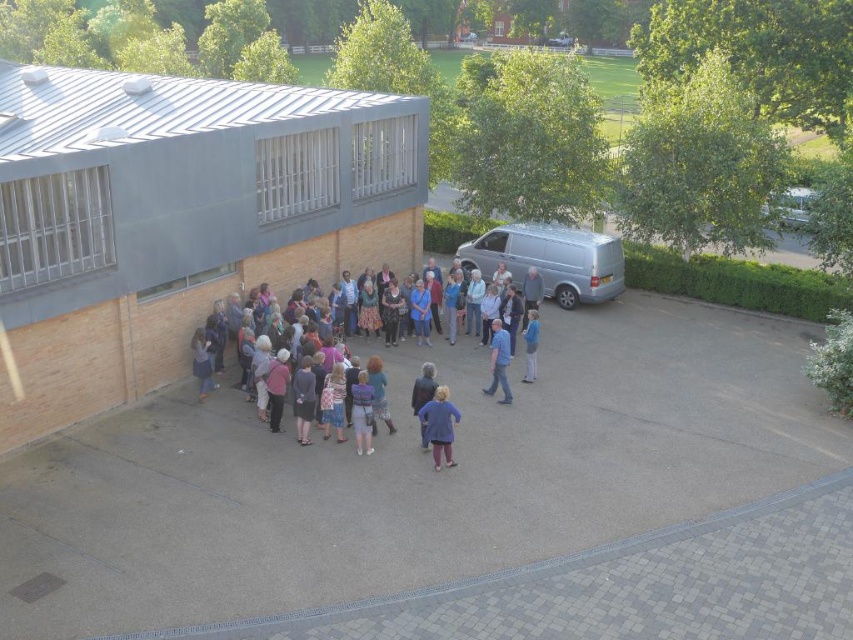
Is multicolored casual attire at center wider than white metallic van at upper right?

No, multicolored casual attire at center is not wider than white metallic van at upper right.

Who is taller, multicolored casual attire at center or white metallic van at upper right?

white metallic van at upper right is taller.

What do you see at coordinates (392, 378) in the screenshot?
I see `multicolored casual attire at center` at bounding box center [392, 378].

At what (x,y) coordinates should I click in order to perform the action: click on multicolored casual attire at center. Please return your answer as a coordinate pair (x, y). The height and width of the screenshot is (640, 853). Looking at the image, I should click on click(392, 378).

Is point (436, 371) positioned before point (498, 326)?

No, it is behind (498, 326).

Can you confirm if multicolored casual attire at center is smaller than blue jeans at center?

Yes, multicolored casual attire at center is smaller than blue jeans at center.

What do you see at coordinates (392, 378) in the screenshot? The width and height of the screenshot is (853, 640). I see `multicolored casual attire at center` at bounding box center [392, 378].

At what (x,y) coordinates should I click in order to perform the action: click on multicolored casual attire at center. Please return your answer as a coordinate pair (x, y). The image size is (853, 640). Looking at the image, I should click on (392, 378).

Consider the image. Which is above, silver metallic van at center or blue jeans at center?

Positioned higher is silver metallic van at center.

Measure the distance between point (567, 305) and camera.

They are 23.32 meters apart.

Where is `silver metallic van at center`? The image size is (853, 640). silver metallic van at center is located at coordinates (550, 259).